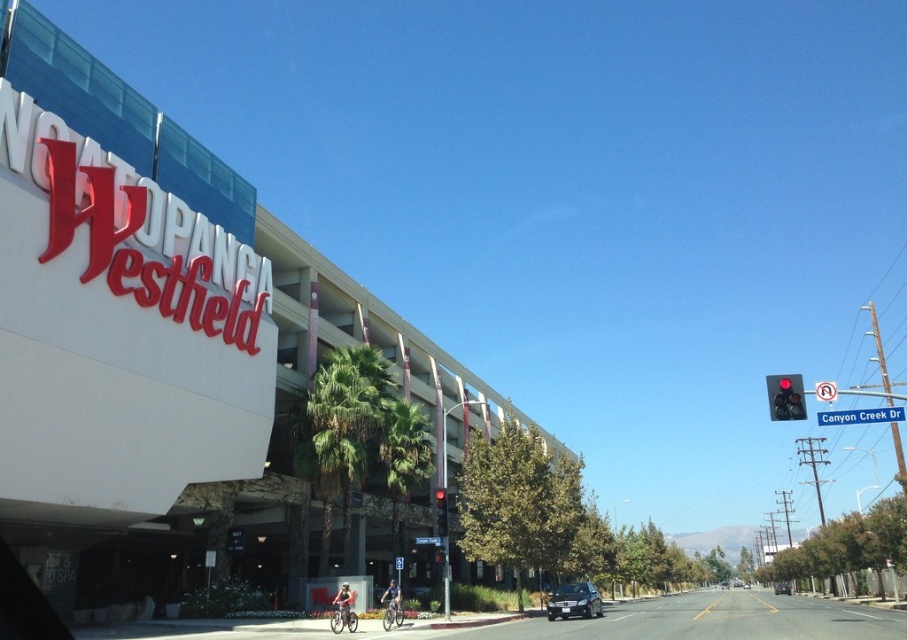
Question: Which point is farther to the camera?

Choices:
 (A) white concrete mall at upper left
 (B) black plastic traffic light at right
 (C) red glass traffic light at upper right
 (D) black matte sedan at center

Answer: (D)

Question: Does white concrete mall at upper left have a larger size compared to red glass traffic light at upper right?

Choices:
 (A) yes
 (B) no

Answer: (A)

Question: Where is red glass traffic light at upper right located in relation to black matte sedan at center in the image?

Choices:
 (A) below
 (B) above

Answer: (B)

Question: Can you confirm if blue plastic street sign at upper right is positioned above black matte sedan at center?

Choices:
 (A) yes
 (B) no

Answer: (A)

Question: Among these points, which one is nearest to the camera?

Choices:
 (A) pos(850,417)
 (B) pos(785,588)
 (C) pos(788,397)

Answer: (C)

Question: Considering the real-world distances, which object is farthest from the black matte sedan at center?

Choices:
 (A) blue plastic street sign at upper right
 (B) black plastic traffic light at right
 (C) red glass traffic light at upper right

Answer: (A)